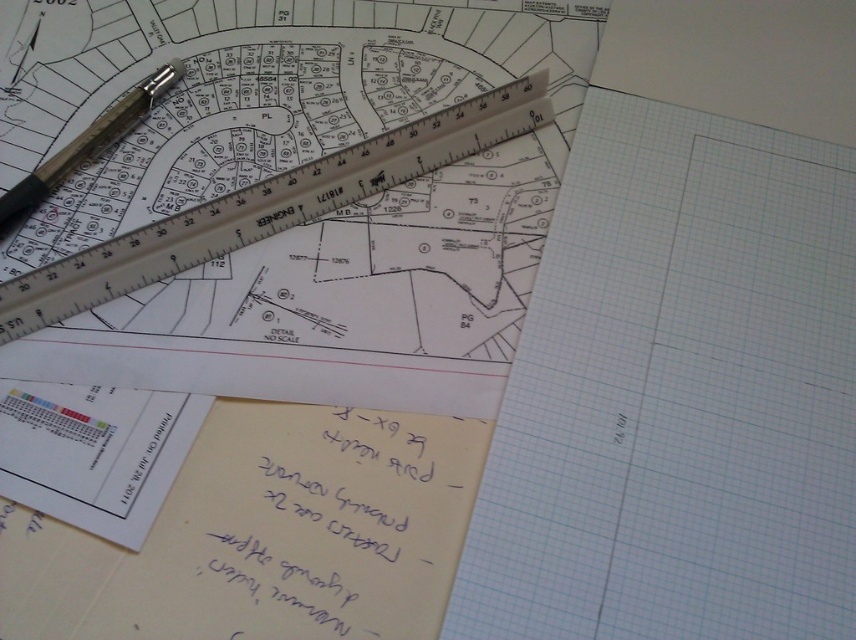
Does point (444, 144) lie in front of point (49, 180)?

No, it is behind (49, 180).

Does metallic silver ruler at upper center have a larger size compared to metallic silver pen at upper left?

Yes.

This screenshot has height=640, width=856. I want to click on metallic silver ruler at upper center, so click(268, 205).

Between point (817, 397) and point (378, 161), which one is positioned behind?

The point (378, 161) is more distant.

Can you confirm if white grid paper at center is smaller than metallic silver ruler at upper center?

Actually, white grid paper at center might be larger than metallic silver ruler at upper center.

Which is in front, point (586, 257) or point (266, 202)?

Point (586, 257)

Image resolution: width=856 pixels, height=640 pixels. Find the location of `white grid paper at center`. white grid paper at center is located at coordinates (676, 394).

Is white grid paper at center above metallic silver pen at upper left?

Actually, white grid paper at center is below metallic silver pen at upper left.

Who is more forward, (626, 136) or (117, 116)?

Point (626, 136)

Between point (551, 234) and point (75, 161), which one is positioned in front?

Point (551, 234) is more forward.

You are a GUI agent. You are given a task and a screenshot of the screen. Output one action in this format:
    pyautogui.click(x=<x>, y=<y>)
    Task: Click on the white grid paper at center
    
    Given the screenshot: What is the action you would take?
    pyautogui.click(x=676, y=394)